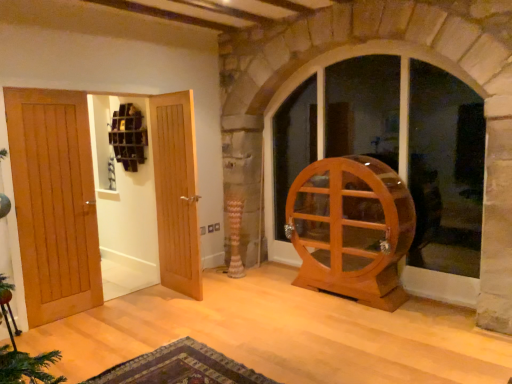
I want to click on vacant area located to the right-hand side of light brown wood door at left, which appears as the 2th door when viewed from the right, so click(x=145, y=306).